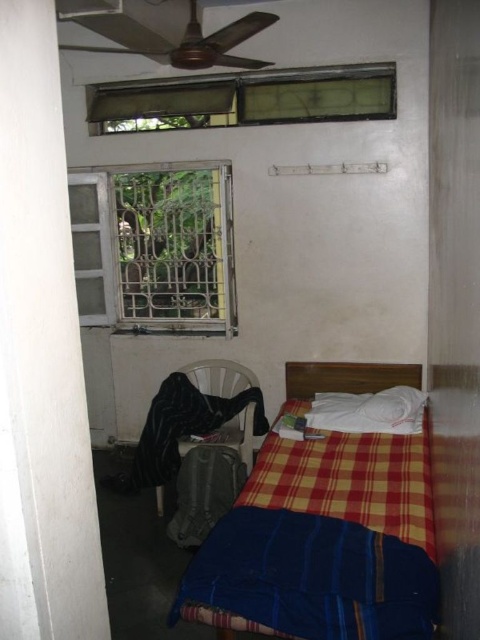
Who is more forward, (417, 378) or (301, 452)?

Positioned in front is point (301, 452).

Which of these two, plaid fabric bed at center or plaid fabric bedspread at center, stands taller?

Standing taller between the two is plaid fabric bed at center.

Which is behind, point (348, 600) or point (295, 483)?

Positioned behind is point (295, 483).

Locate an element on the screen. The height and width of the screenshot is (640, 480). plaid fabric bed at center is located at coordinates (324, 544).

Which is more to the left, plaid fabric bedspread at center or green glass window at upper center?

green glass window at upper center

How much distance is there between plaid fabric bedspread at center and green glass window at upper center?

plaid fabric bedspread at center is 2.22 meters from green glass window at upper center.

The width and height of the screenshot is (480, 640). I want to click on plaid fabric bedspread at center, so click(x=349, y=481).

Which is more to the right, plaid fabric bed at center or white soft pillow at center?

white soft pillow at center is more to the right.

Which of these two, plaid fabric bed at center or white soft pillow at center, stands taller?

Standing taller between the two is plaid fabric bed at center.

Measure the distance between plaid fabric bed at center and camera.

1.75 meters

This screenshot has width=480, height=640. Find the location of `plaid fabric bed at center`. plaid fabric bed at center is located at coordinates (324, 544).